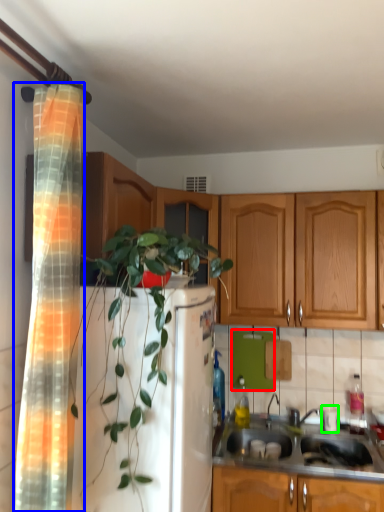
Question: Estimate the real-world distances between objects in this image. Which object is closer to appliance (highlighted by a red box), shower curtain (highlighted by a blue box) or appliance (highlighted by a green box)?

Choices:
 (A) shower curtain
 (B) appliance

Answer: (B)